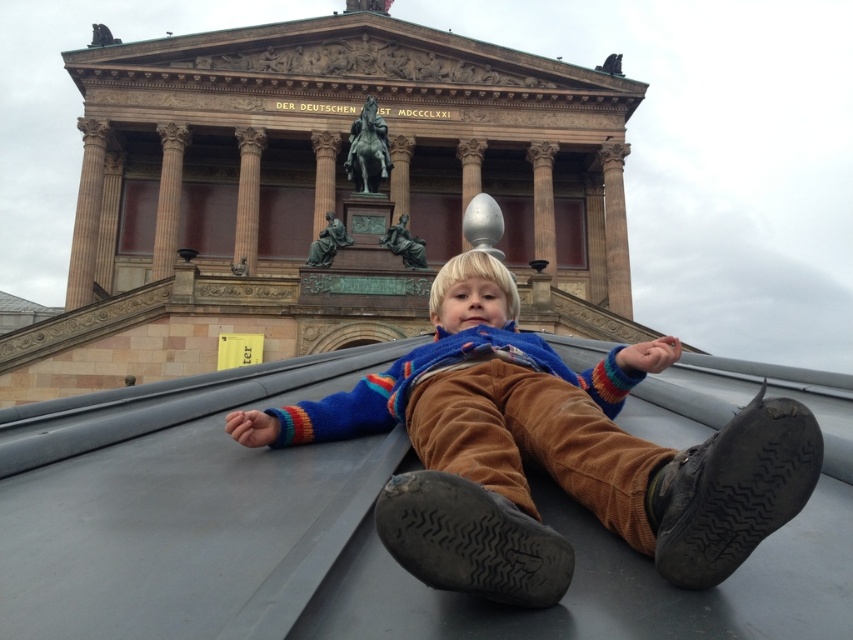
You are an architect designing a model of the building shown. You have two columns to choose from for the central structure. The brown polished stone column at center and the satin gold column at center. Which column should you select if you want the central column to be wider?

The brown polished stone column at center should be selected because its width is larger than the satin gold column at center.